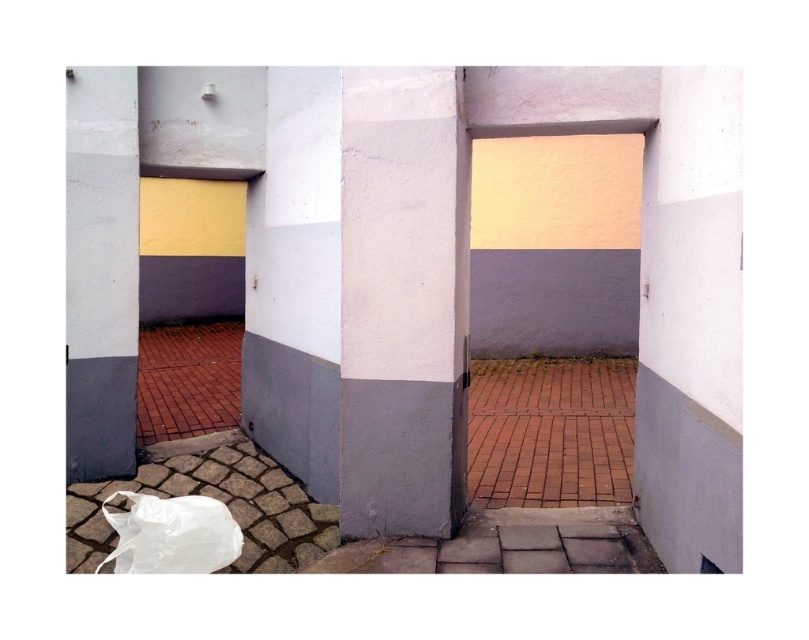
Is white matte pillar at center positioned behind white plastic bag at lower left?

Yes, white matte pillar at center is behind white plastic bag at lower left.

Does white matte pillar at center have a lesser height compared to white plastic bag at lower left?

In fact, white matte pillar at center may be taller than white plastic bag at lower left.

Where is `white matte pillar at center`? The image size is (809, 640). white matte pillar at center is located at coordinates coord(403,300).

In the scene shown: Does white matte pillar at center have a greater width compared to matte gray concrete pillar at left?

Indeed, white matte pillar at center has a greater width compared to matte gray concrete pillar at left.

Which is above, white matte pillar at center or matte gray concrete pillar at left?

matte gray concrete pillar at left is higher up.

Describe the element at coordinates (403, 300) in the screenshot. I see `white matte pillar at center` at that location.

I want to click on white matte pillar at center, so 403,300.

Does matte gray concrete pillar at left have a smaller size compared to white plastic bag at lower left?

Result: No, matte gray concrete pillar at left is not smaller than white plastic bag at lower left.

Is point (123, 378) positioned behind point (117, 531)?

Yes, point (123, 378) is farther from viewer.

You are a GUI agent. You are given a task and a screenshot of the screen. Output one action in this format:
    pyautogui.click(x=<x>, y=<y>)
    Task: Click on the matte gray concrete pillar at left
    
    Given the screenshot: What is the action you would take?
    pyautogui.click(x=100, y=272)